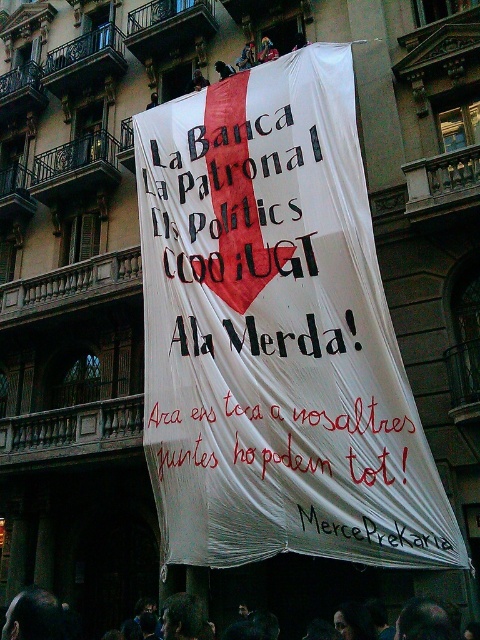
You are a photographer trying to capture the protest banner. You notice two points marked on the banner at coordinates point (54,605) and point (423,536). Which point should you focus on to ensure it appears larger in your photo?

Point (54,605) is closer to the camera than point (423,536), so focusing on point (54,605) will make it appear larger in the photo.

What is the relationship in height between the red fabric banner at center and the dark hair at lower center?

The red fabric banner at center is not as tall as dark hair at lower center.